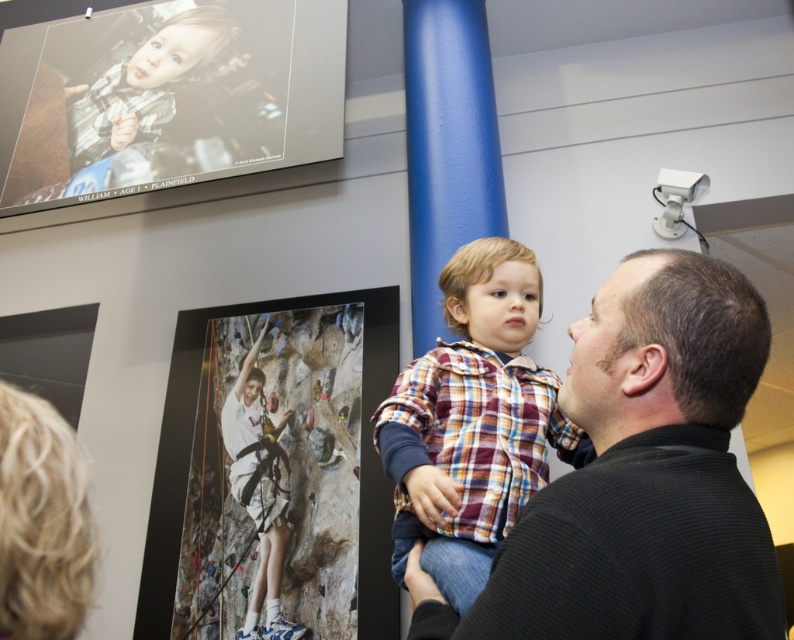
Does plaid fabric shirt at center appear on the left side of white cotton shirt at upper center?

In fact, plaid fabric shirt at center is to the right of white cotton shirt at upper center.

Can you confirm if plaid fabric shirt at center is bigger than white cotton shirt at upper center?

Yes.

This screenshot has height=640, width=794. I want to click on plaid fabric shirt at center, so click(x=473, y=420).

Locate an element on the screen. The width and height of the screenshot is (794, 640). white fabric climbing harness at center is located at coordinates (274, 477).

Is point (290, 454) more distant than point (260, 387)?

No, it is not.

I want to click on white fabric climbing harness at center, so click(274, 477).

Does black textured shirt at center have a lesser width compared to white fabric climbing harness at center?

Indeed, black textured shirt at center has a lesser width compared to white fabric climbing harness at center.

Between point (607, 452) and point (303, 332), which one is positioned behind?

Positioned behind is point (303, 332).

Is point (611, 310) in front of point (230, 464)?

Yes, point (611, 310) is in front of point (230, 464).

Where is `black textured shirt at center`? black textured shirt at center is located at coordinates (642, 476).